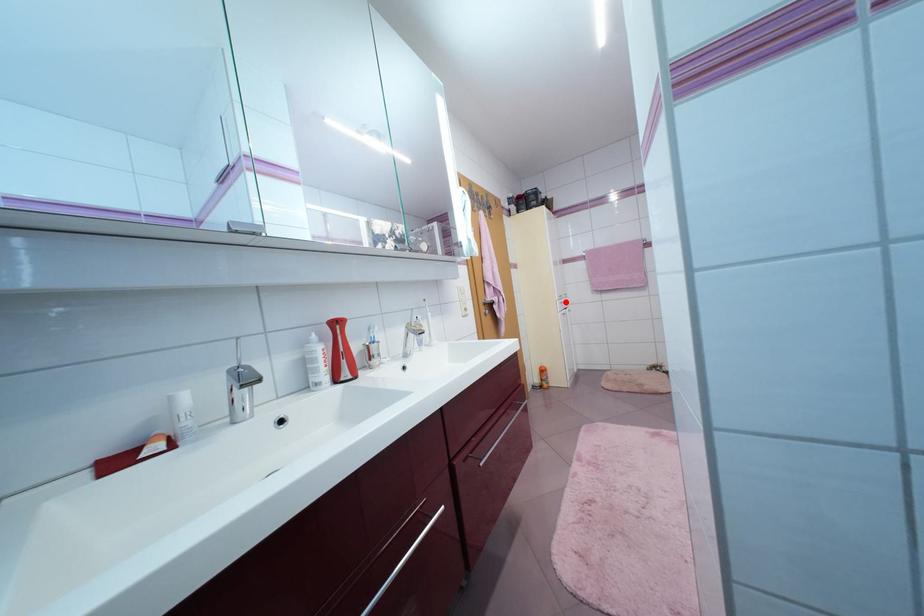
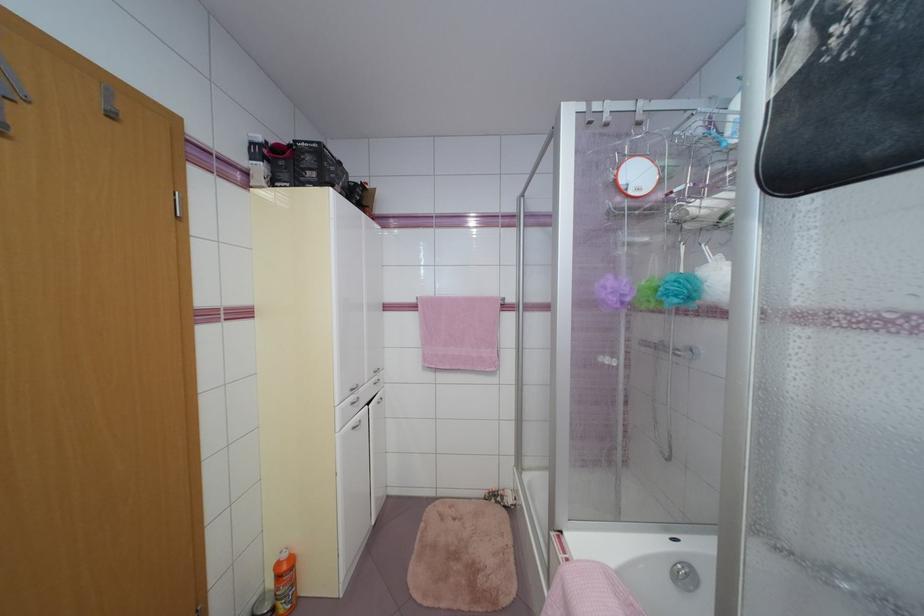
The point at the highlighted location is marked in the first image. Where is the corresponding point in the second image?

(357, 400)